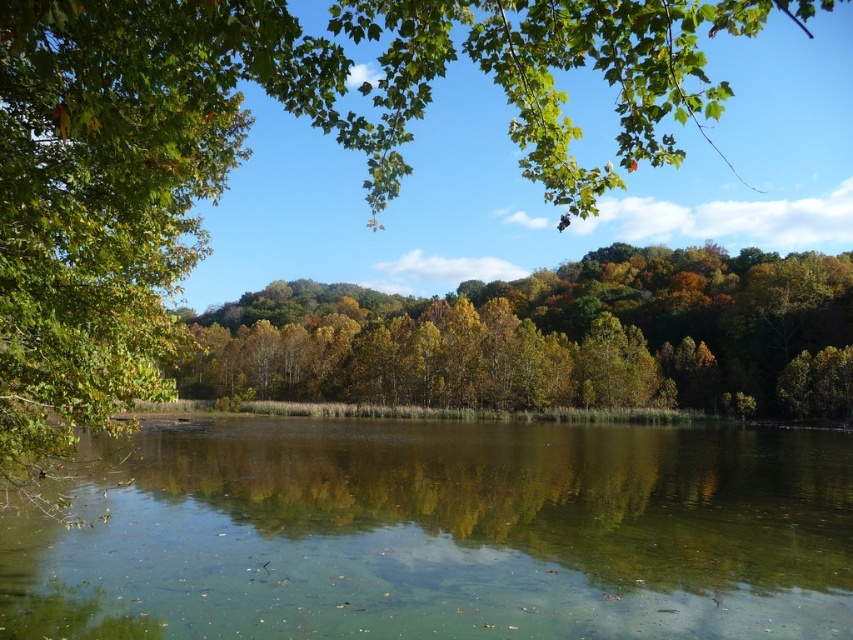
Based on the scene, which object takes up more area in the image between the green translucent water at center and the green leafy trees at center?

The green leafy trees at center occupy more area than the green translucent water at center in the image.

From the picture: You are a photographer standing at the edge of the water in the scene. You want to take a photo that includes both the point at location (583, 528) and the point at (518, 404). Which point will appear larger in your photo?

Point (583, 528) will appear larger in the photo because it is closer to the camera than point (518, 404).